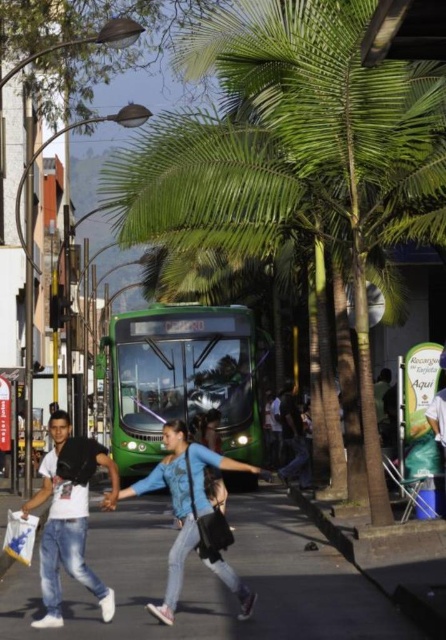
Question: Which of the following is the closest to the observer?

Choices:
 (A) (283, 433)
 (B) (375, 465)
 (C) (79, 540)
 (D) (193, 470)

Answer: (C)

Question: Is denim jeans at center to the left of white plastic bag at lower left from the viewer's perspective?

Choices:
 (A) no
 (B) yes

Answer: (A)

Question: Does denim jeans at center appear on the right side of white plastic bag at lower left?

Choices:
 (A) no
 (B) yes

Answer: (B)

Question: Does smooth concrete pavement at center come in front of dark blue jeans at center?

Choices:
 (A) yes
 (B) no

Answer: (A)

Question: Among these objects, which one is nearest to the camera?

Choices:
 (A) smooth concrete pavement at center
 (B) white plastic bag at lower left
 (C) green leafy palm tree at center

Answer: (C)

Question: Among these points, which one is farthest from the camera?

Choices:
 (A) (243, 522)
 (B) (297, 433)
 (C) (174, 380)
 (D) (4, 544)

Answer: (B)